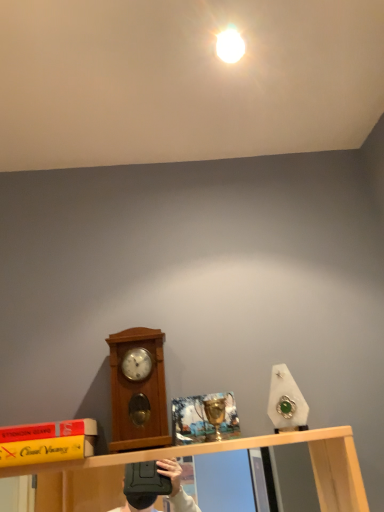
At what (x,y) coordinates should I click in order to perform the action: click on white glossy light bulb at upper center. Please return your answer as a coordinate pair (x, y). The height and width of the screenshot is (512, 384). Looking at the image, I should click on (230, 45).

Describe the element at coordinates (230, 45) in the screenshot. The image size is (384, 512). I see `white glossy light bulb at upper center` at that location.

Consider the image. What is the approximate width of wooden clock at left?

The width of wooden clock at left is 4.16 inches.

Image resolution: width=384 pixels, height=512 pixels. What do you see at coordinates (138, 392) in the screenshot?
I see `wooden clock at left` at bounding box center [138, 392].

This screenshot has height=512, width=384. What are the coordinates of `wooden clock at left` in the screenshot? It's located at (138, 392).

Find the location of a particular element. This screenshot has height=512, width=384. white glossy light bulb at upper center is located at coordinates (230, 45).

Considering the relative positions of wooden clock at left and white glossy light bulb at upper center in the image provided, is wooden clock at left to the right of white glossy light bulb at upper center from the viewer's perspective?

No, wooden clock at left is not to the right of white glossy light bulb at upper center.

Between wooden clock at left and white glossy light bulb at upper center, which one is positioned in front?

wooden clock at left is more forward.

Which is nearer, (144, 446) or (226, 47)?

The point (144, 446) is more forward.

From the image's perspective, is wooden clock at left over white glossy light bulb at upper center?

Incorrect, from the image's perspective, wooden clock at left is lower than white glossy light bulb at upper center.

From a real-world perspective, is wooden clock at left above or below white glossy light bulb at upper center?

Result: In terms of real-world spatial position, wooden clock at left is below white glossy light bulb at upper center.

Can you confirm if wooden clock at left is thinner than white glossy light bulb at upper center?

Incorrect, the width of wooden clock at left is not less than that of white glossy light bulb at upper center.

Considering the relative sizes of wooden clock at left and white glossy light bulb at upper center in the image provided, is wooden clock at left shorter than white glossy light bulb at upper center?

No, wooden clock at left is not shorter than white glossy light bulb at upper center.

Based on the photo, between wooden clock at left and white glossy light bulb at upper center, which one has larger size?

With larger size is wooden clock at left.

Does wooden clock at left contain white glossy light bulb at upper center?

Actually, white glossy light bulb at upper center is outside wooden clock at left.

In the scene shown: Would you say wooden clock at left is a long distance from white glossy light bulb at upper center?

No, there isn't a large distance between wooden clock at left and white glossy light bulb at upper center.

Is white glossy light bulb at upper center at the back of wooden clock at left?

wooden clock at left is not turned away from white glossy light bulb at upper center.

Consider the image. Can you tell me how much wooden clock at left and white glossy light bulb at upper center differ in facing direction?

The angular difference between wooden clock at left and white glossy light bulb at upper center is 89.6 degrees.

How much distance is there between wooden clock at left and white glossy light bulb at upper center?

The distance of wooden clock at left from white glossy light bulb at upper center is 73.95 centimeters.

What are the coordinates of `clock lying below the white glossy light bulb at upper center (from the image's perspective)` in the screenshot? It's located at (138, 392).

Which object is positioned more to the left, white glossy light bulb at upper center or wooden clock at left?

wooden clock at left.

Is white glossy light bulb at upper center in front of or behind wooden clock at left in the image?

white glossy light bulb at upper center is positioned farther from the viewer than wooden clock at left.

Is point (226, 53) less distant than point (153, 364)?

Yes, it is.

From the image's perspective, is white glossy light bulb at upper center below wooden clock at left?

No.

From a real-world perspective, is white glossy light bulb at upper center above or below wooden clock at left?

Clearly, from a real-world perspective, white glossy light bulb at upper center is above wooden clock at left.

In terms of width, does white glossy light bulb at upper center look wider or thinner when compared to wooden clock at left?

Considering their sizes, white glossy light bulb at upper center looks slimmer than wooden clock at left.

Consider the image. Can you confirm if white glossy light bulb at upper center is taller than wooden clock at left?

Incorrect, the height of white glossy light bulb at upper center is not larger of that of wooden clock at left.

Considering the relative sizes of white glossy light bulb at upper center and wooden clock at left in the image provided, is white glossy light bulb at upper center smaller than wooden clock at left?

Yes.

Is white glossy light bulb at upper center inside the boundaries of wooden clock at left, or outside?

white glossy light bulb at upper center exists outside the volume of wooden clock at left.

Is white glossy light bulb at upper center in contact with wooden clock at left?

white glossy light bulb at upper center is not next to wooden clock at left, and they're not touching.

Could you tell me if white glossy light bulb at upper center is facing wooden clock at left?

No, white glossy light bulb at upper center is not aimed at wooden clock at left.

How different are the orientations of white glossy light bulb at upper center and wooden clock at left in degrees?

They differ by 89.6 degrees in their facing directions.

Locate an element on the screen. This screenshot has width=384, height=512. clock below the white glossy light bulb at upper center (from a real-world perspective) is located at coordinates (138, 392).

Locate an element on the screen. light above the wooden clock at left (from a real-world perspective) is located at coordinates (230, 45).

Find the location of a particular element. This screenshot has width=384, height=512. clock below the white glossy light bulb at upper center (from the image's perspective) is located at coordinates (138, 392).